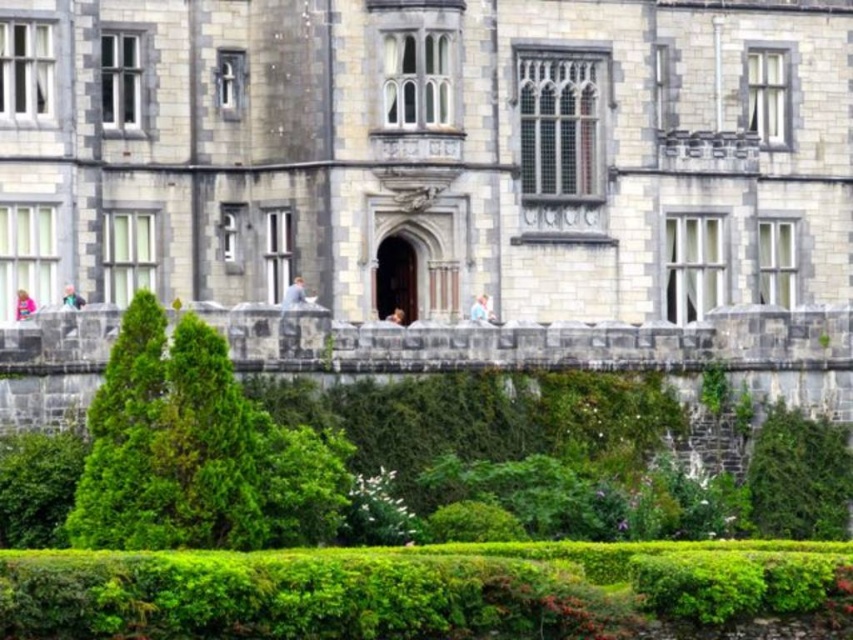
Looking at this image, does green leafy bush at lower right appear over green leafy bush at lower left?

Actually, green leafy bush at lower right is below green leafy bush at lower left.

Does green leafy bush at lower right lie in front of green leafy bush at lower left?

That is False.

You are a GUI agent. You are given a task and a screenshot of the screen. Output one action in this format:
    pyautogui.click(x=<x>, y=<y>)
    Task: Click on the green leafy bush at lower right
    
    Given the screenshot: What is the action you would take?
    pyautogui.click(x=799, y=476)

Can you confirm if green leafy tree at lower left is smaller than green leafy bush at lower right?

Yes, green leafy tree at lower left is smaller than green leafy bush at lower right.

Measure the distance between green leafy tree at lower left and camera.

green leafy tree at lower left is 187.19 feet from camera.

Identify the location of green leafy tree at lower left. pyautogui.click(x=128, y=444).

The height and width of the screenshot is (640, 853). In order to click on green leafy tree at lower left in this screenshot , I will do `click(128, 444)`.

Is green leafy tree at lower left bigger than green leafy bush at lower left?

No.

Consider the image. Can you confirm if green leafy tree at lower left is wider than green leafy bush at lower left?

In fact, green leafy tree at lower left might be narrower than green leafy bush at lower left.

Identify the location of green leafy tree at lower left. (128, 444).